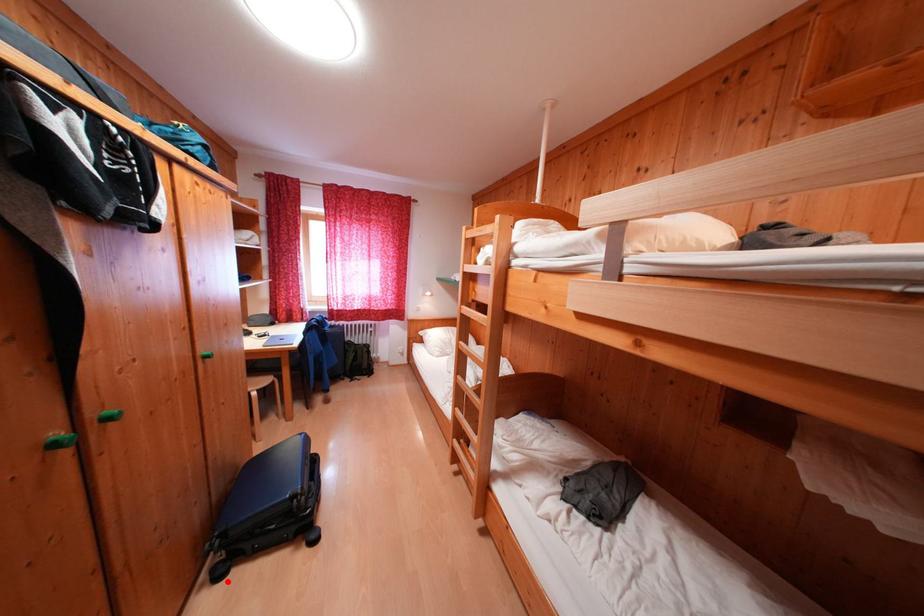
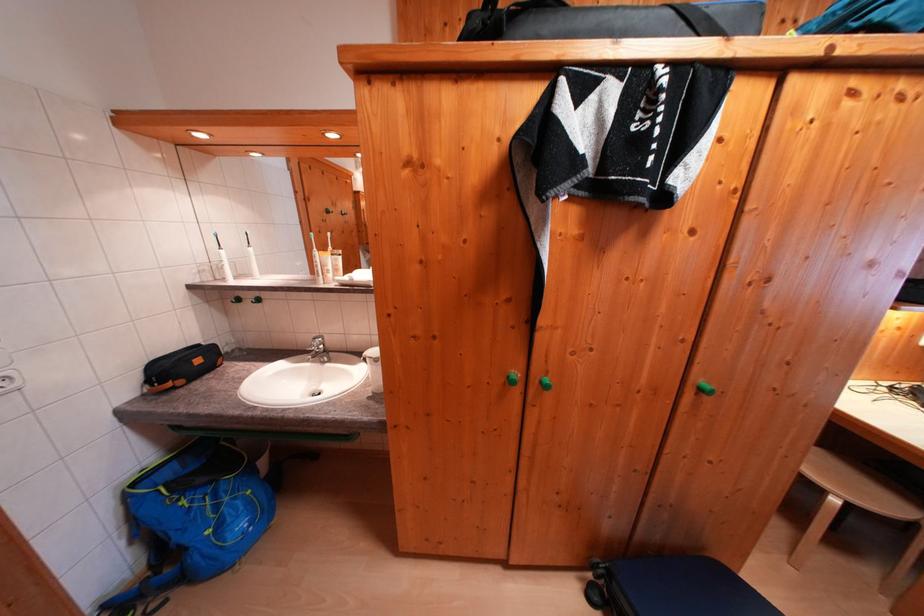
Question: I am providing you with two images of the same scene from different viewpoints. Image1 has a red point marked. In image2, the corresponding 3D location appears at what relative position? Reply with the corresponding letter.

Choices:
 (A) Closer
 (B) Farther

Answer: (B)